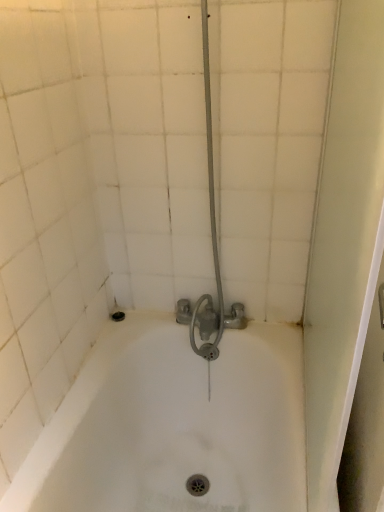
In order to face white ceramic bathtub at center, should I rotate leftwards or rightwards?

To face it directly, rotate left by 1.216 degrees.

Image resolution: width=384 pixels, height=512 pixels. In order to click on white ceramic bathtub at center in this screenshot , I will do `click(174, 425)`.

What do you see at coordinates (174, 425) in the screenshot?
I see `white ceramic bathtub at center` at bounding box center [174, 425].

This screenshot has width=384, height=512. I want to click on white ceramic bathtub at center, so click(x=174, y=425).